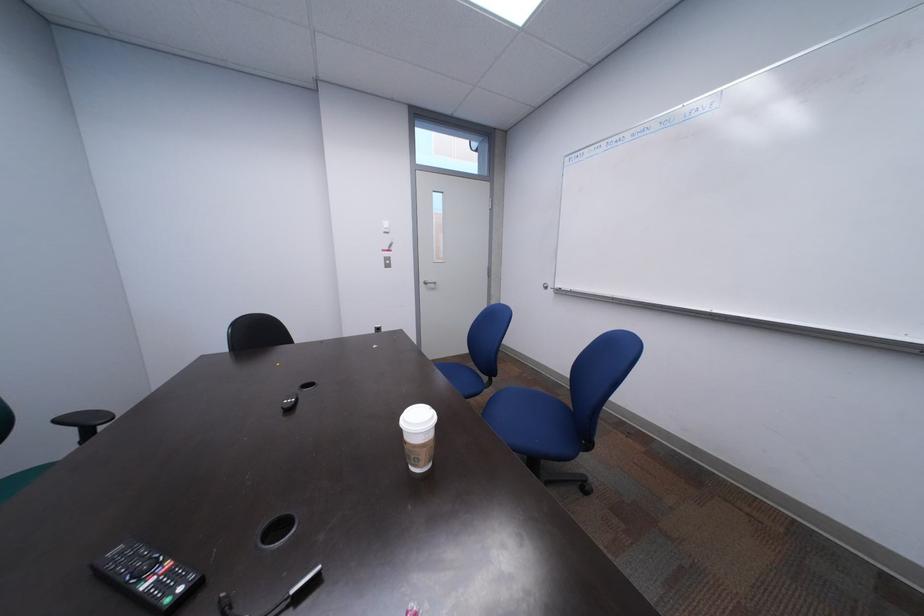
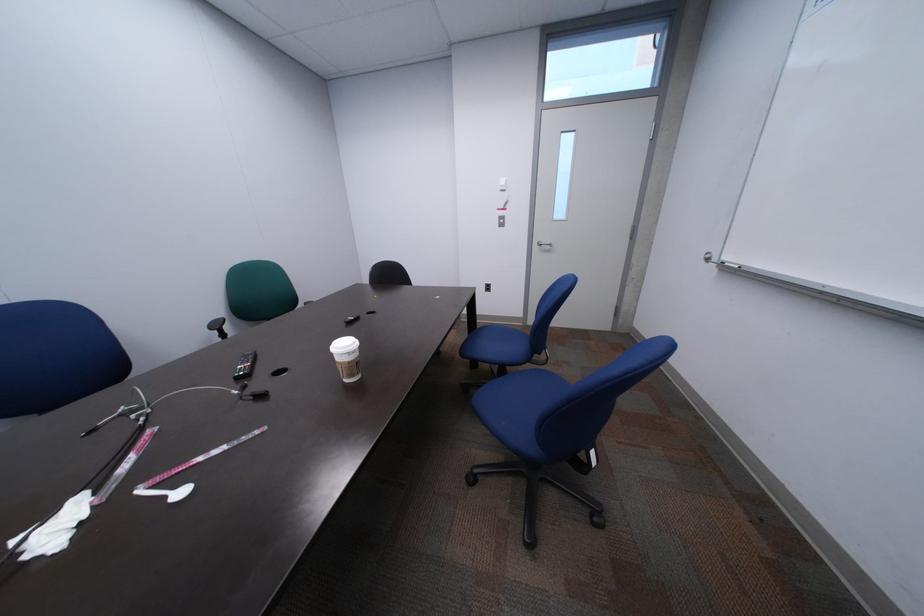
Question: The camera is either moving clockwise (left) or counter-clockwise (right) around the object. The first image is from the beginning of the video and the second image is from the end. Is the camera moving left or right when shooting the video?

Choices:
 (A) Left
 (B) Right

Answer: (B)